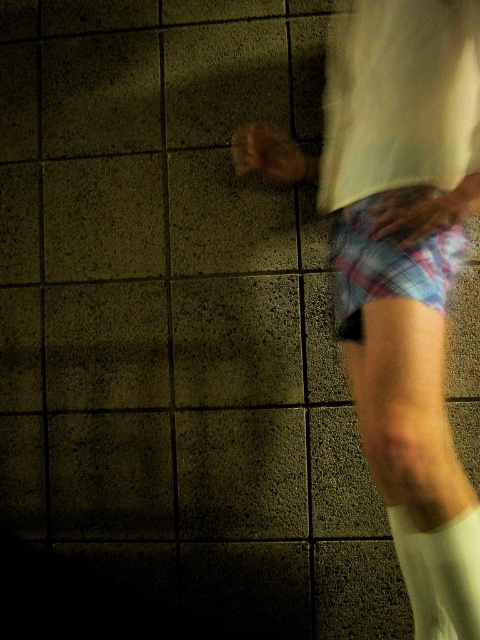
From the picture: Is plaid shorts at right in front of plaid fabric shorts at lower right?

Yes, it is.

Is plaid shorts at right wider than plaid fabric shorts at lower right?

Yes, plaid shorts at right is wider than plaid fabric shorts at lower right.

The height and width of the screenshot is (640, 480). What are the coordinates of `plaid shorts at right` in the screenshot? It's located at (400, 266).

Who is more distant from viewer, (x=380, y=260) or (x=429, y=579)?

The point (x=429, y=579) is behind.

What do you see at coordinates (388, 259) in the screenshot?
I see `plaid fabric shorts at lower right` at bounding box center [388, 259].

I want to click on plaid fabric shorts at lower right, so click(x=388, y=259).

This screenshot has height=640, width=480. What are the coordinates of `plaid fabric shorts at lower right` in the screenshot? It's located at (388, 259).

Does point (412, 102) come in front of point (467, 518)?

No, (412, 102) is behind (467, 518).

Does white fabric shirt at upper right come behind white soft sock at lower right?

That is False.

Between point (405, 124) and point (408, 588), which one is positioned behind?

Point (408, 588)

At what (x,y) coordinates should I click in order to perform the action: click on white fabric shirt at upper right. Please return your answer as a coordinate pair (x, y). Image resolution: width=480 pixels, height=640 pixels. Looking at the image, I should click on (399, 97).